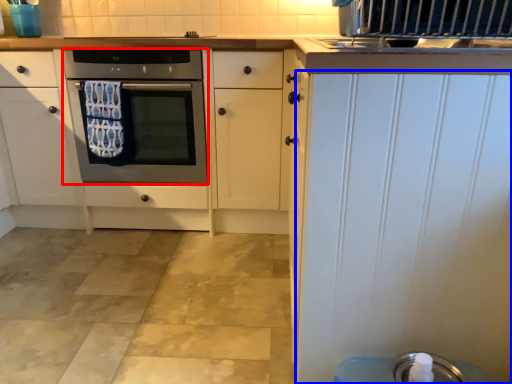
Question: Which point is closer to the camera, oven (highlighted by a red box) or door (highlighted by a blue box)?

Choices:
 (A) oven
 (B) door

Answer: (B)